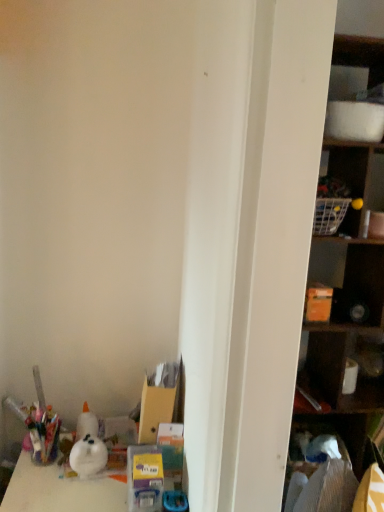
Measure the distance between matte black cabinet at right and camera.

The distance of matte black cabinet at right from camera is 1.50 meters.

Describe the element at coordinates (336, 369) in the screenshot. I see `matte black cabinet at right` at that location.

You are a GUI agent. You are given a task and a screenshot of the screen. Output one action in this format:
    pyautogui.click(x=<x>, y=<y>)
    Task: Click on the matte black cabinet at right
    The width and height of the screenshot is (384, 512).
    Given the screenshot: What is the action you would take?
    pyautogui.click(x=336, y=369)

Locate an element on the screen. The width and height of the screenshot is (384, 512). wooden shelf at right is located at coordinates (346, 306).

What do you see at coordinates (346, 306) in the screenshot? This screenshot has width=384, height=512. I see `wooden shelf at right` at bounding box center [346, 306].

Where is `matte black cabinet at right`? matte black cabinet at right is located at coordinates (336, 369).

Considering the positions of objects matte black cabinet at right and wooden shelf at right in the image provided, who is more to the right, matte black cabinet at right or wooden shelf at right?

From the viewer's perspective, wooden shelf at right appears more on the right side.

Which is behind, matte black cabinet at right or wooden shelf at right?

matte black cabinet at right.

Is point (317, 355) positioned before point (308, 347)?

That is False.

From the image's perspective, which one is positioned lower, matte black cabinet at right or wooden shelf at right?

matte black cabinet at right.

Looking at this image, from a real-world perspective, relative to wooden shelf at right, is matte black cabinet at right vertically above or below?

matte black cabinet at right is situated lower than wooden shelf at right in the real world.

From the picture: Looking at their sizes, would you say matte black cabinet at right is wider or thinner than wooden shelf at right?

In the image, matte black cabinet at right appears to be more narrow than wooden shelf at right.

Can you confirm if matte black cabinet at right is taller than wooden shelf at right?

No.

Considering the sizes of objects matte black cabinet at right and wooden shelf at right in the image provided, who is smaller, matte black cabinet at right or wooden shelf at right?

matte black cabinet at right is smaller.

Which is correct: matte black cabinet at right is inside wooden shelf at right, or outside of it?

matte black cabinet at right is spatially positioned inside wooden shelf at right.

Would you say matte black cabinet at right is a long distance from wooden shelf at right?

Actually, matte black cabinet at right and wooden shelf at right are a little close together.

Is matte black cabinet at right oriented towards wooden shelf at right?

Yes, matte black cabinet at right is facing wooden shelf at right.

Image resolution: width=384 pixels, height=512 pixels. In order to click on shelf above the matte black cabinet at right (from a real-world perspective) in this screenshot , I will do `click(346, 306)`.

Can you confirm if wooden shelf at right is positioned to the right of matte black cabinet at right?

Yes.

Is wooden shelf at right positioned behind matte black cabinet at right?

No, it is not.

Which is closer to the camera, (320,426) or (335,335)?

Point (335,335)

From the image's perspective, relative to matte black cabinet at right, is wooden shelf at right above or below?

Based on their image positions, wooden shelf at right is located above matte black cabinet at right.

From a real-world perspective, which is physically below, wooden shelf at right or matte black cabinet at right?

From a 3D spatial view, matte black cabinet at right is below.

Does wooden shelf at right have a greater width compared to matte black cabinet at right?

Yes, wooden shelf at right is wider than matte black cabinet at right.

Considering the sizes of wooden shelf at right and matte black cabinet at right in the image, is wooden shelf at right taller or shorter than matte black cabinet at right?

Clearly, wooden shelf at right is taller compared to matte black cabinet at right.

Does wooden shelf at right have a smaller size compared to matte black cabinet at right?

Actually, wooden shelf at right might be larger than matte black cabinet at right.

Consider the image. Is wooden shelf at right outside of matte black cabinet at right?

Indeed, wooden shelf at right is completely outside matte black cabinet at right.

Would you say wooden shelf at right is a long distance from matte black cabinet at right?

No, there isn't a large distance between wooden shelf at right and matte black cabinet at right.

Does wooden shelf at right turn towards matte black cabinet at right?

Yes, wooden shelf at right faces towards matte black cabinet at right.

From the picture: What's the angular difference between wooden shelf at right and matte black cabinet at right's facing directions?

The angle between the facing direction of wooden shelf at right and the facing direction of matte black cabinet at right is 0.00133 degrees.

Identify the location of shelf that is in front of the matte black cabinet at right. The height and width of the screenshot is (512, 384). (346, 306).

I want to click on cabinet behind the wooden shelf at right, so click(x=336, y=369).

You are a GUI agent. You are given a task and a screenshot of the screen. Output one action in this format:
    pyautogui.click(x=<x>, y=<y>)
    Task: Click on the cabinet that appears on the left of wooden shelf at right
    
    Given the screenshot: What is the action you would take?
    pyautogui.click(x=336, y=369)